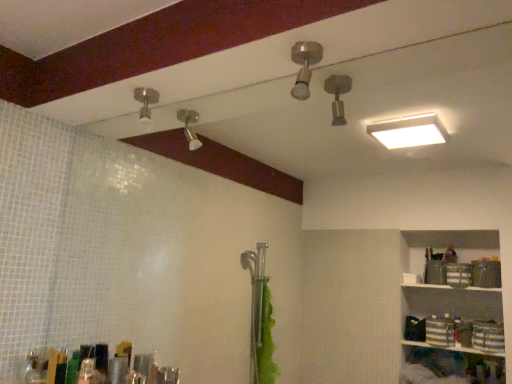
Identify the location of satin nickel shower head at upper center. (304, 66).

Measure the distance between point (318, 45) and camera.

The depth of point (318, 45) is 1.06 meters.

What do you see at coordinates (304, 66) in the screenshot?
I see `satin nickel shower head at upper center` at bounding box center [304, 66].

In order to face satin nickel shower head at upper center, should I rotate leftwards or rightwards?

You should rotate right by 6.864 degrees.

The image size is (512, 384). What are the coordinates of `satin nickel shower head at upper center` in the screenshot? It's located at (304, 66).